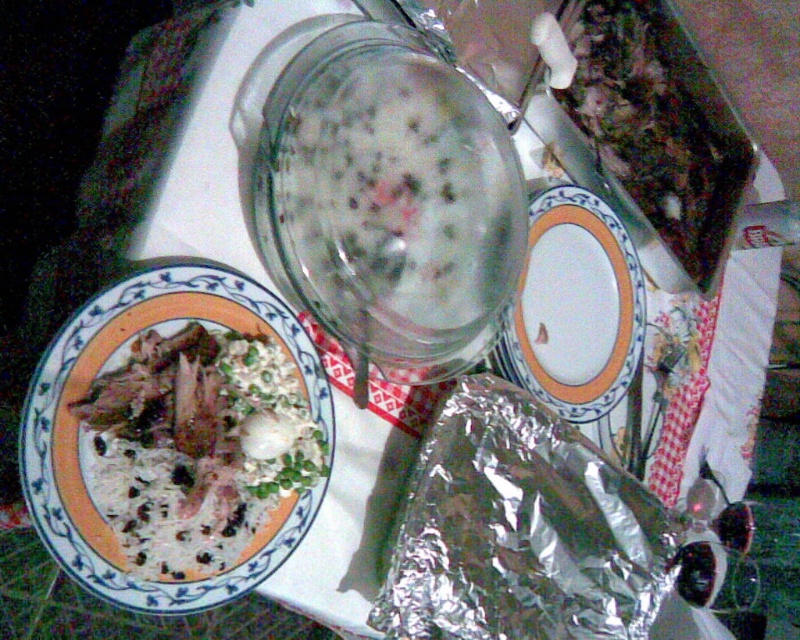
Question: Can you confirm if white matte rice bowl at left is wider than white ceramic plate at center?

Choices:
 (A) yes
 (B) no

Answer: (B)

Question: Which point is closer to the camera?

Choices:
 (A) (644, 538)
 (B) (202, 432)
 (C) (362, 120)

Answer: (B)

Question: Which object appears closest to the camera in this image?

Choices:
 (A) shiny metallic foil at lower right
 (B) white matte rice bowl at left
 (C) translucent glass jar at center
 (D) white ceramic plate at center

Answer: (B)

Question: Where is translucent glass jar at center located in relation to white matte rice bowl at left in the image?

Choices:
 (A) left
 (B) right

Answer: (B)

Question: Estimate the real-world distances between objects in this image. Which object is closer to the translucent glass jar at center?

Choices:
 (A) shiny metallic foil at lower right
 (B) white matte rice bowl at left
 (C) green leafy vegetables at upper right

Answer: (B)

Question: Can you confirm if white matte rice bowl at left is positioned below green leafy vegetables at upper right?

Choices:
 (A) yes
 (B) no

Answer: (A)